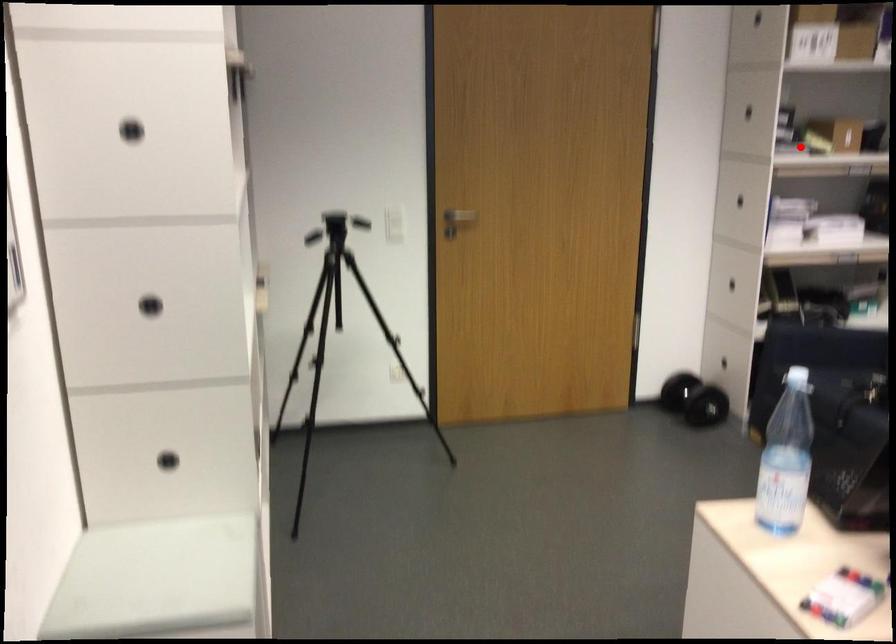
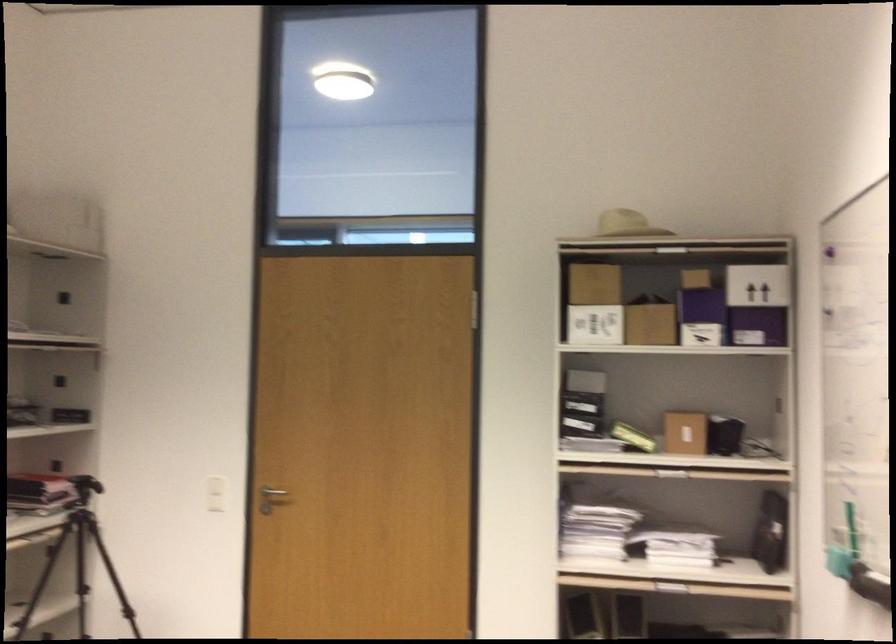
The point at the highlighted location is marked in the first image. Where is the corresponding point in the second image?

(633, 437)